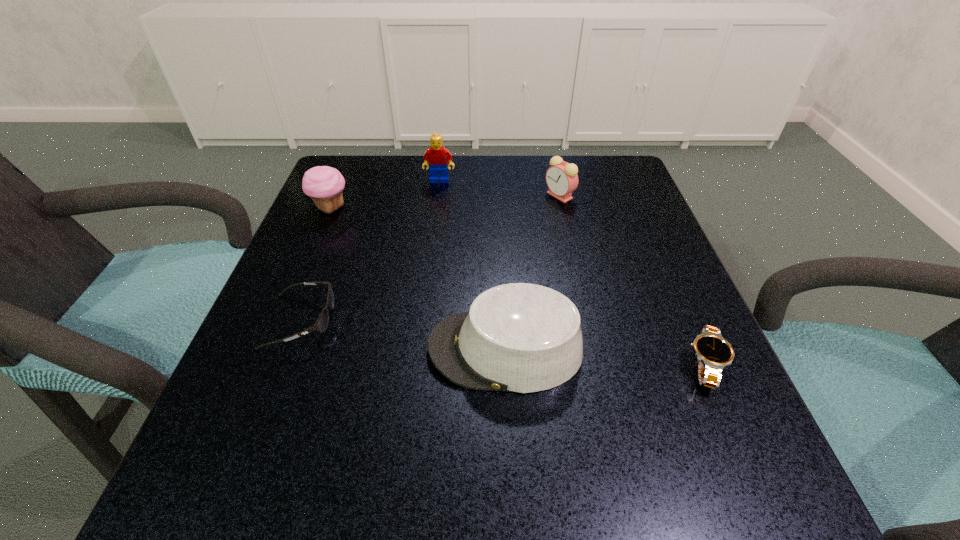
Locate an element on the screen. Image resolution: width=960 pixels, height=540 pixels. vacant space located 0.280m on the face of the alarm clock is located at coordinates (421, 195).

In order to click on vacant area situated 0.280m on the face of the alarm clock in this screenshot , I will do `click(421, 195)`.

Locate an element on the screen. This screenshot has height=540, width=960. free space located 0.260m on the face of the alarm clock is located at coordinates (430, 195).

Locate an element on the screen. free space located 0.270m on the front-facing side of the hat is located at coordinates [256, 349].

Identify the location of vacant space located 0.170m on the front-facing side of the hat. The width and height of the screenshot is (960, 540). point(320,349).

This screenshot has width=960, height=540. Identify the location of vacant space located on the front-facing side of the hat. (320, 349).

This screenshot has width=960, height=540. Identify the location of blank space located on the front-facing side of the second shortest object. (418, 321).

You are a GUI agent. You are given a task and a screenshot of the screen. Output one action in this format:
    pyautogui.click(x=<x>, y=<y>)
    Task: Click on the free space located on the back of the rightmost object
    The height and width of the screenshot is (540, 960).
    Given the screenshot: What is the action you would take?
    pyautogui.click(x=672, y=292)

The height and width of the screenshot is (540, 960). I want to click on Lego at the far edge, so click(x=438, y=156).

Identify the location of cupcake that is at the far edge. (324, 184).